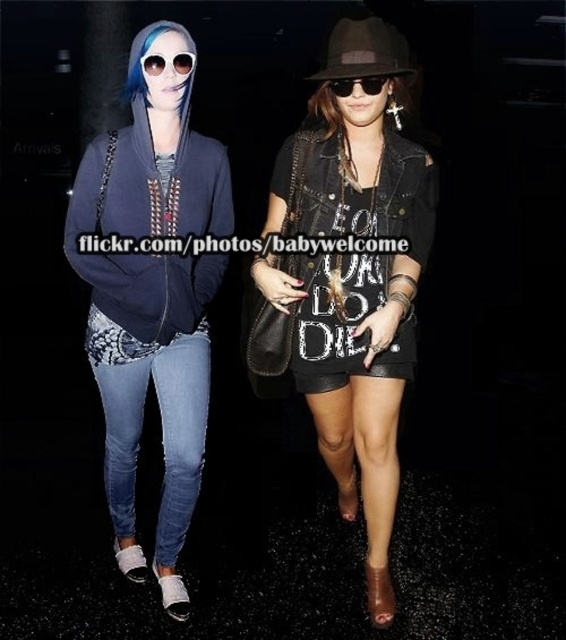
What do you see at coordinates (365, 51) in the screenshot? Image resolution: width=566 pixels, height=640 pixels. I see `dark brown felt fedora at upper center` at bounding box center [365, 51].

Does dark brown felt fedora at upper center have a greater height compared to white reflective goggles at upper left?

Indeed, dark brown felt fedora at upper center has a greater height compared to white reflective goggles at upper left.

Who is more distant from viewer, (379,19) or (171,65)?

The point (171,65) is more distant.

You are a GUI agent. You are given a task and a screenshot of the screen. Output one action in this format:
    pyautogui.click(x=<x>, y=<y>)
    Task: Click on the dark brown felt fedora at upper center
    The height and width of the screenshot is (640, 566).
    Given the screenshot: What is the action you would take?
    point(365,51)

Does point (410, 216) come in front of point (200, 362)?

Yes, it is.

Which is behind, point (308, 371) or point (158, 524)?

Positioned behind is point (158, 524).

Find the location of a particular element. leather shorts at center is located at coordinates (354, 273).

Which is more to the left, leather shorts at center or brown textured hair at center?

From the viewer's perspective, brown textured hair at center appears more on the left side.

Does leather shorts at center appear on the left side of brown textured hair at center?

No, leather shorts at center is not to the left of brown textured hair at center.

You are a GUI agent. You are given a task and a screenshot of the screen. Output one action in this format:
    pyautogui.click(x=<x>, y=<y>)
    Task: Click on the leather shorts at center
    Image resolution: width=566 pixels, height=640 pixels.
    Given the screenshot: What is the action you would take?
    pyautogui.click(x=354, y=273)

Locate an element on the screen. The width and height of the screenshot is (566, 640). leather shorts at center is located at coordinates (354, 273).